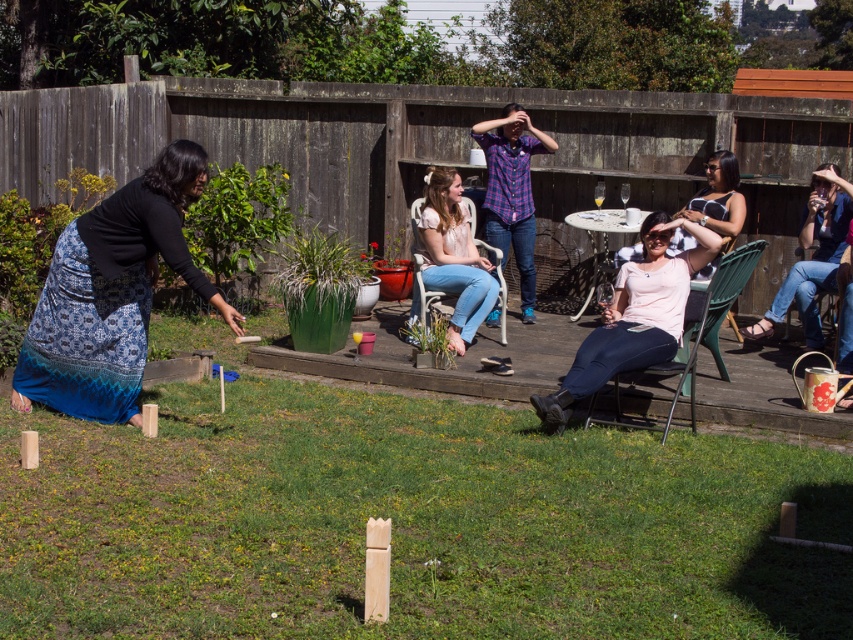
Question: Does natural grass at center have a larger size compared to blue printed skirt at lower left?

Choices:
 (A) no
 (B) yes

Answer: (B)

Question: Can you confirm if blue jeans at right is positioned to the left of denim fabric chair at right?

Choices:
 (A) no
 (B) yes

Answer: (A)

Question: Which point is closer to the camera?

Choices:
 (A) (721, 280)
 (B) (724, 227)
 (C) (850, 468)

Answer: (C)

Question: Does blue printed skirt at lower left have a lesser width compared to blue jeans at right?

Choices:
 (A) yes
 (B) no

Answer: (B)

Question: Which object is positioned farthest from the blue jeans at right?

Choices:
 (A) denim fabric chair at center
 (B) green plastic chair at center-right

Answer: (A)

Question: Which object is the closest to the green plastic chair at center-right?

Choices:
 (A) blue printed skirt at lower left
 (B) matte pink shirt at center
 (C) blue jeans at right

Answer: (B)